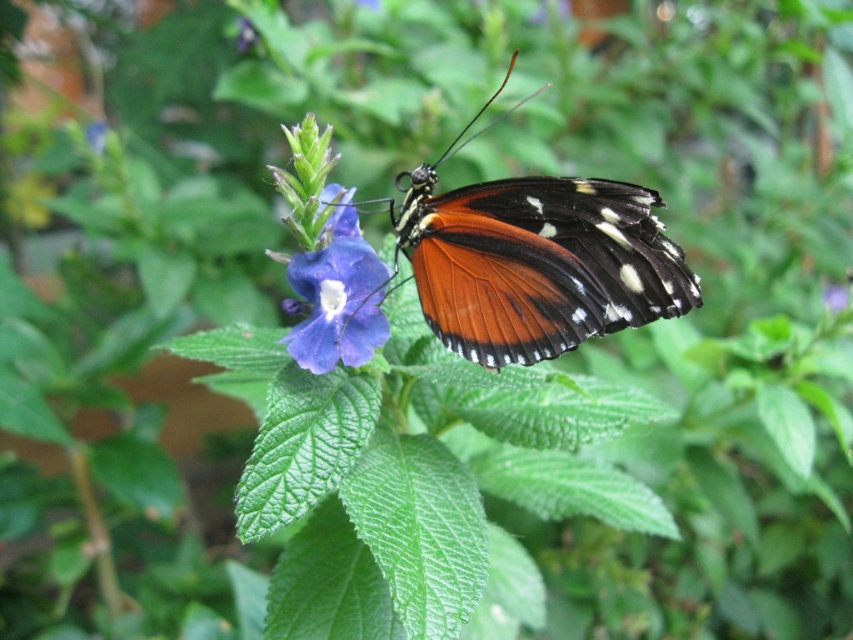
Is point (631, 268) closer to viewer compared to point (315, 305)?

That is True.

Who is positioned more to the left, orange matte butterfly at center or matte purple flower at center?

From the viewer's perspective, matte purple flower at center appears more on the left side.

Is point (664, 317) positioned before point (283, 307)?

Yes, point (664, 317) is closer to viewer.

Where is `orange matte butterfly at center`? The height and width of the screenshot is (640, 853). orange matte butterfly at center is located at coordinates (534, 260).